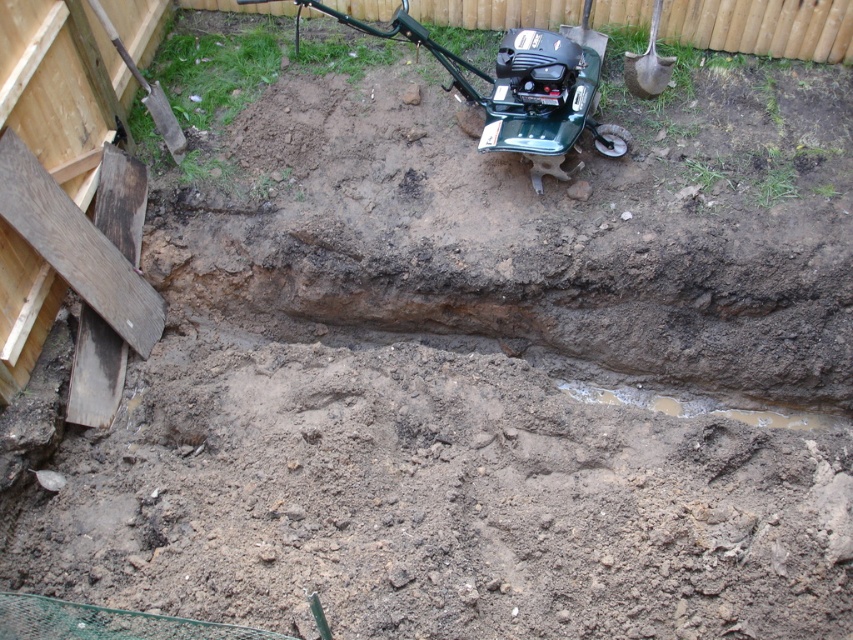
Question: Which point is farther to the camera?

Choices:
 (A) wooden shovel at upper left
 (B) green metallic mower at center

Answer: (A)

Question: Does green metallic mower at center appear on the right side of wooden shovel at upper left?

Choices:
 (A) yes
 (B) no

Answer: (A)

Question: Which of the following is the farthest from the observer?

Choices:
 (A) (108, 28)
 (B) (651, 74)
 (C) (515, 61)

Answer: (B)

Question: Considering the relative positions of green metallic mower at center and brown wooden shovel at upper right in the image provided, where is green metallic mower at center located with respect to brown wooden shovel at upper right?

Choices:
 (A) right
 (B) left

Answer: (B)

Question: Is green metallic mower at center behind brown wooden shovel at upper right?

Choices:
 (A) no
 (B) yes

Answer: (A)

Question: Among these points, which one is farthest from the camera?

Choices:
 (A) (654, 45)
 (B) (558, 74)

Answer: (A)